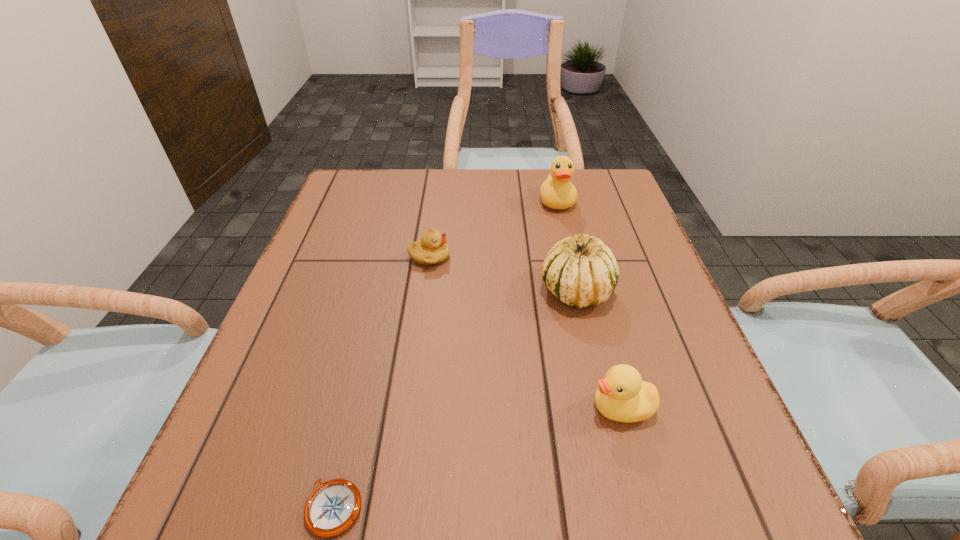
You are a GUI agent. You are given a task and a screenshot of the screen. Output one action in this format:
    pyautogui.click(x=<x>, y=<y>)
    Task: Click on the object located in the far right corner section of the desktop
    The width and height of the screenshot is (960, 540).
    Given the screenshot: What is the action you would take?
    pyautogui.click(x=557, y=192)

Where is `free region at the far edge of the desktop`? Image resolution: width=960 pixels, height=540 pixels. free region at the far edge of the desktop is located at coordinates (494, 207).

At what (x,y) coordinates should I click in order to perform the action: click on blank space at the near edge of the desktop. Please return your answer as a coordinate pair (x, y). Looking at the image, I should click on (632, 505).

In the image, there is a desktop. Find the location of `vacant space at the left edge`. vacant space at the left edge is located at coordinates (369, 232).

Find the location of a particular element. The width and height of the screenshot is (960, 540). free space at the right edge of the desktop is located at coordinates (686, 467).

At what (x,y) coordinates should I click in order to perform the action: click on free space at the far left corner of the desktop. Please return your answer as a coordinate pair (x, y). Looking at the image, I should click on (346, 183).

The image size is (960, 540). I want to click on vacant space at the near right corner, so click(x=685, y=510).

At what (x,y) coordinates should I click in order to perform the action: click on empty space between the farthest object and the fourth tallest object. Please return your answer as a coordinate pair (x, y). Looking at the image, I should click on (493, 230).

Identify the location of vacant area between the nearest object and the farthest object. The image size is (960, 540). (445, 355).

Where is `unoccupied area between the gourd and the duckling`? This screenshot has width=960, height=540. unoccupied area between the gourd and the duckling is located at coordinates (502, 274).